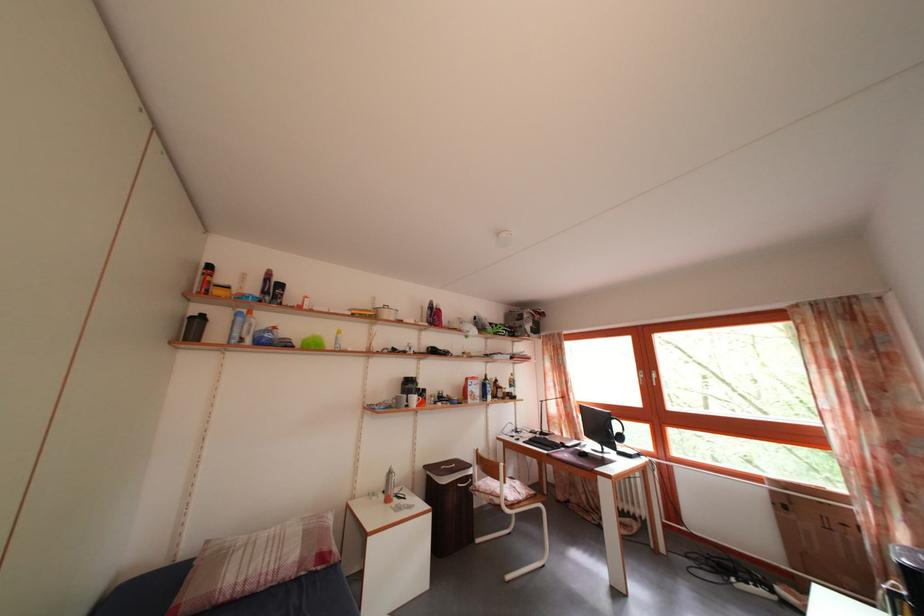
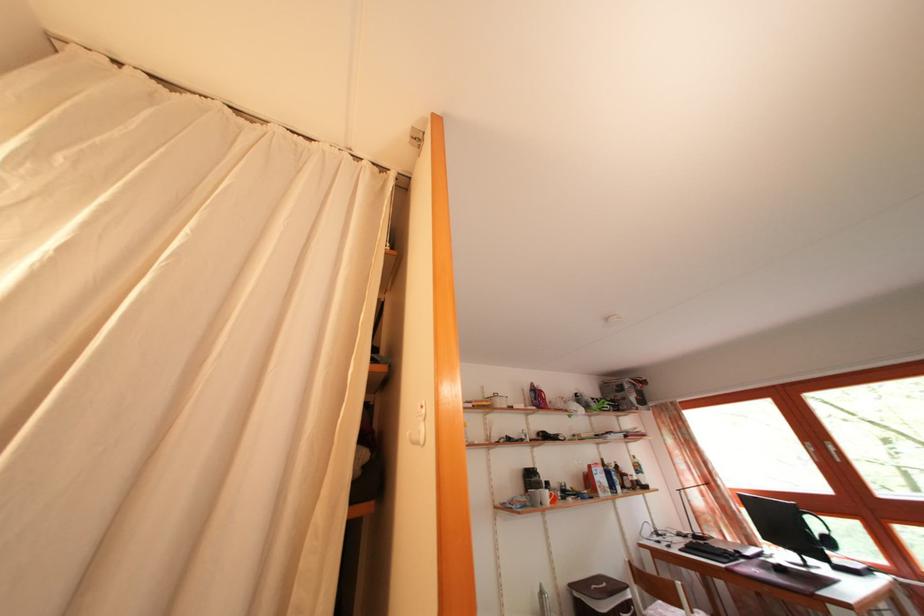
In the second image, find the point that corresponds to (628,445) in the first image.

(837, 549)